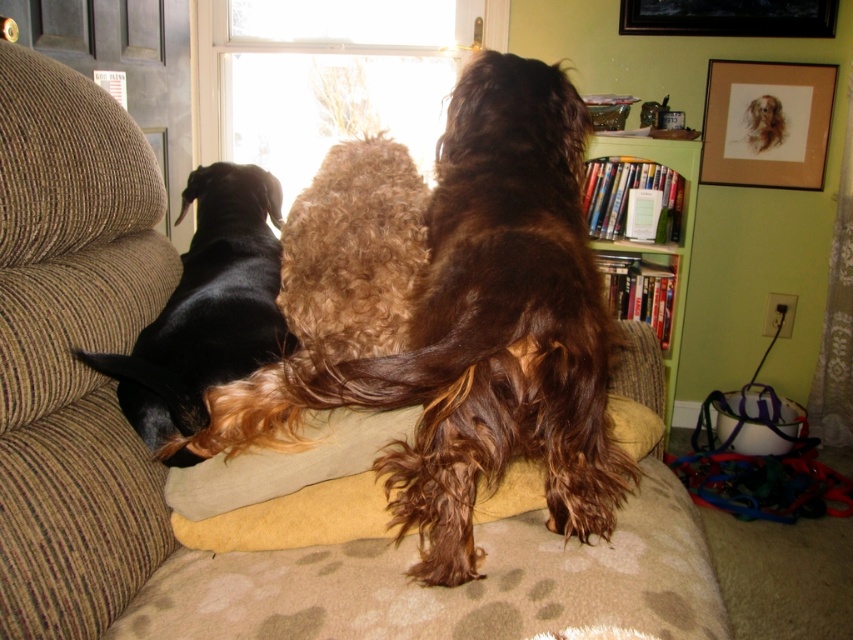
Question: Is curly golden fur at center positioned in front of green wood bookshelf at upper right?

Choices:
 (A) no
 (B) yes

Answer: (B)

Question: Can you confirm if transparent glass window at upper center is smaller than green wood bookshelf at upper right?

Choices:
 (A) no
 (B) yes

Answer: (A)

Question: Among these objects, which one is nearest to the camera?

Choices:
 (A) green wood bookshelf at upper right
 (B) transparent glass window at upper center
 (C) brown curly fur dog at center
 (D) curly golden fur at center

Answer: (C)

Question: Is black shiny dog at left to the right of curly golden fur at center from the viewer's perspective?

Choices:
 (A) no
 (B) yes

Answer: (A)

Question: Which object is closer to the camera taking this photo?

Choices:
 (A) transparent glass window at upper center
 (B) curly golden fur at center

Answer: (B)

Question: Which object appears closest to the camera in this image?

Choices:
 (A) brown curly fur dog at center
 (B) black shiny dog at left

Answer: (A)